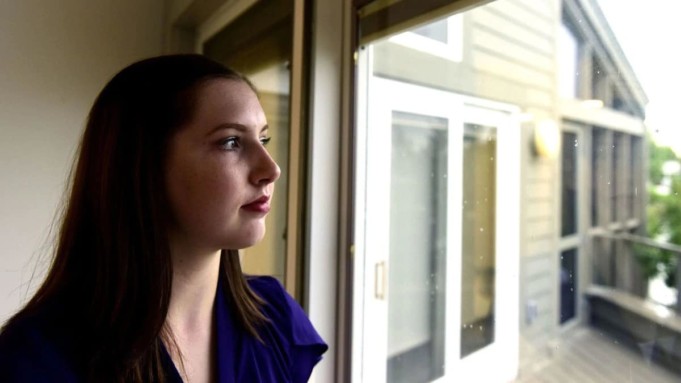
The width and height of the screenshot is (681, 383). Find the location of `window`. window is located at coordinates (464, 250).